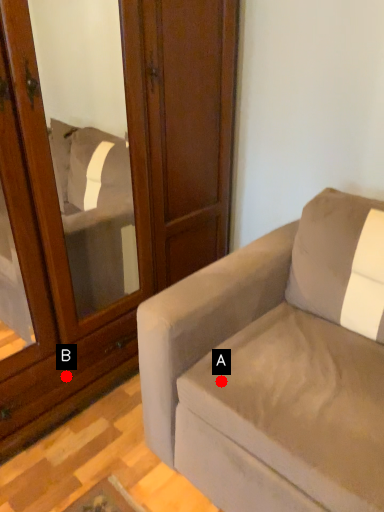
Question: Two points are circled on the image, labeled by A and B beside each circle. Which point appears closest to the camera in this image?

Choices:
 (A) A is closer
 (B) B is closer

Answer: (A)